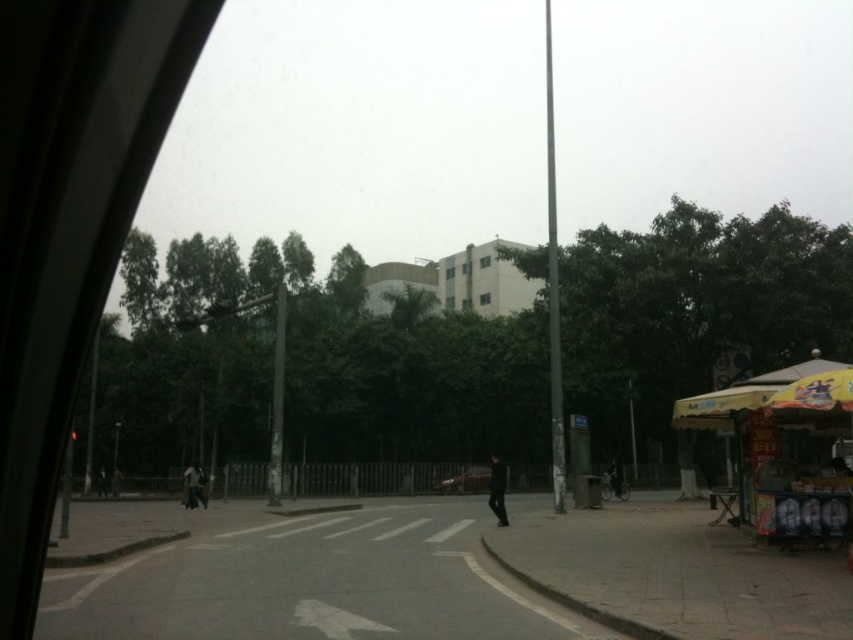
Can you confirm if smooth gray pole at center is wider than shiny red car at center?

Yes, smooth gray pole at center is wider than shiny red car at center.

Who is lower down, smooth gray pole at center or shiny red car at center?

shiny red car at center is below.

Identify the location of smooth gray pole at center. (277, 397).

I want to click on smooth gray pole at center, so click(277, 397).

Who is higher up, metallic pole at left or black matte person at lower left?

metallic pole at left is higher up.

Between metallic pole at left and black matte person at lower left, which one is positioned lower?

black matte person at lower left is below.

Between point (84, 483) and point (102, 492), which one is positioned in front?

Point (102, 492)

Identify the location of metallic pole at left. This screenshot has height=640, width=853. (x=91, y=412).

Describe the element at coordinates (553, 288) in the screenshot. This screenshot has width=853, height=640. I see `silver metallic pole at center` at that location.

Image resolution: width=853 pixels, height=640 pixels. Identify the location of silver metallic pole at center. (553, 288).